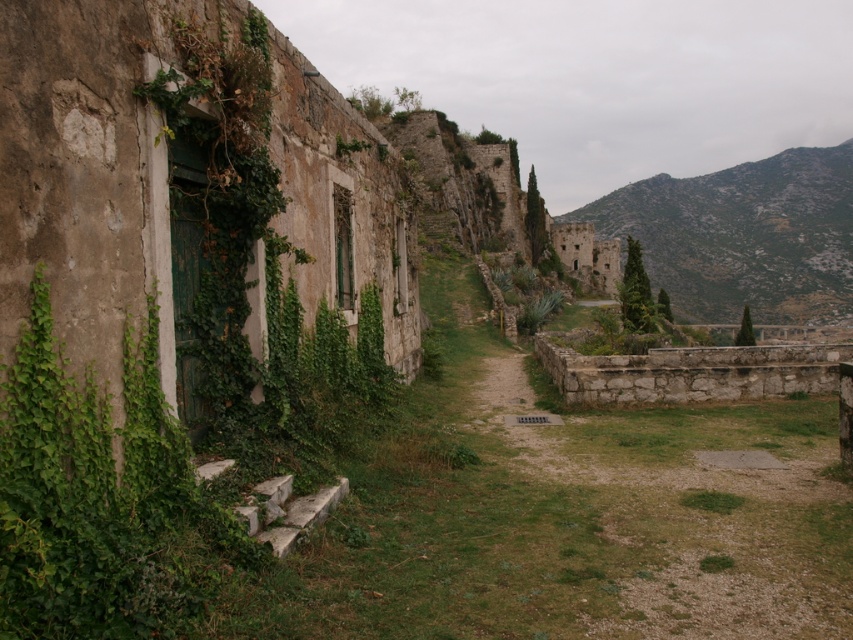
Who is shorter, green ivy at left or green leafy bush at upper right?

With less height is green ivy at left.

Is point (117, 520) less distant than point (741, 312)?

Yes, it is.

Where is `green ivy at left`? The height and width of the screenshot is (640, 853). green ivy at left is located at coordinates (100, 499).

Who is shorter, green ivy at left or rugged stone hillside at upper right?

green ivy at left is shorter.

Where is `green ivy at left`? The height and width of the screenshot is (640, 853). green ivy at left is located at coordinates (100, 499).

Is rugged stone hillside at upper right to the left of green leafy bush at upper right from the viewer's perspective?

In fact, rugged stone hillside at upper right is to the right of green leafy bush at upper right.

Who is higher up, rugged stone hillside at upper right or green leafy bush at upper right?

Positioned higher is rugged stone hillside at upper right.

Is point (712, 269) positioned after point (744, 342)?

Yes, point (712, 269) is behind point (744, 342).

Locate an element on the screen. The width and height of the screenshot is (853, 640). rugged stone hillside at upper right is located at coordinates (743, 236).